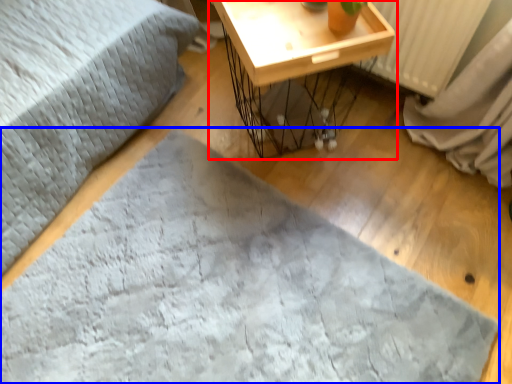
Question: Which point is closer to the camera, table (highlighted by a red box) or sheet (highlighted by a blue box)?

Choices:
 (A) table
 (B) sheet

Answer: (B)